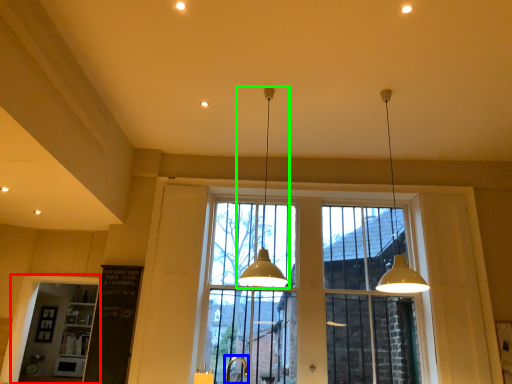
Question: Which is nearer to the window frame (highlighted by a red box)? faucet (highlighted by a blue box) or lamp (highlighted by a green box).

Choices:
 (A) faucet
 (B) lamp

Answer: (A)